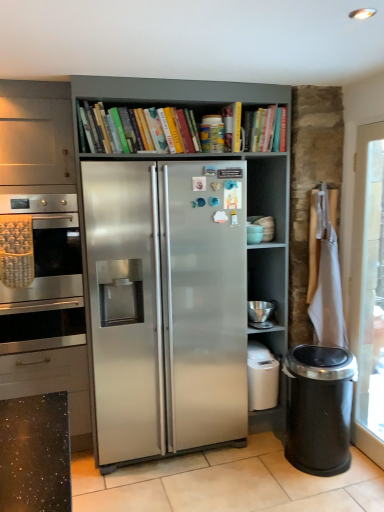
At what (x,y) coordinates should I click in order to perform the action: click on free space in front of satin silver fridge at center. Please return your answer as a coordinate pair (x, y). This screenshot has width=384, height=512. Looking at the image, I should click on (203, 479).